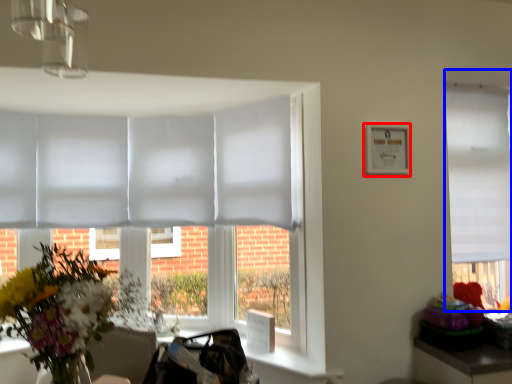
Question: Which point is further to the camera, picture frame (highlighted by a red box) or window (highlighted by a blue box)?

Choices:
 (A) picture frame
 (B) window

Answer: (B)